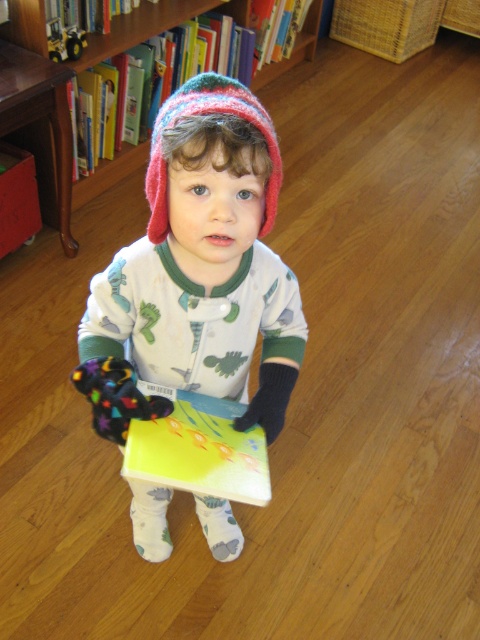
Question: Is knitted wool hat at center positioned at the back of hardcover book at upper center?

Choices:
 (A) yes
 (B) no

Answer: (B)

Question: Among these objects, which one is farthest from the camera?

Choices:
 (A) knitted woolen hat at center
 (B) knitted wool hat at center
 (C) wooden bookcase at upper center
 (D) hardcover book at upper center

Answer: (D)

Question: Is knitted wool hat at center further to camera compared to wooden bookcase at upper center?

Choices:
 (A) no
 (B) yes

Answer: (A)

Question: Which of the following is the closest to the observer?

Choices:
 (A) (149, 408)
 (B) (197, 77)

Answer: (B)

Question: Which object is positioned farthest from the hardcover book at upper center?

Choices:
 (A) knitted wool hat at center
 (B) knitted woolen hat at center
 (C) wooden bookcase at upper center
 (D) yellow paper book at upper center

Answer: (A)

Question: Can you confirm if wooden bookcase at upper center is positioned above hardcover book at upper center?

Choices:
 (A) yes
 (B) no

Answer: (B)